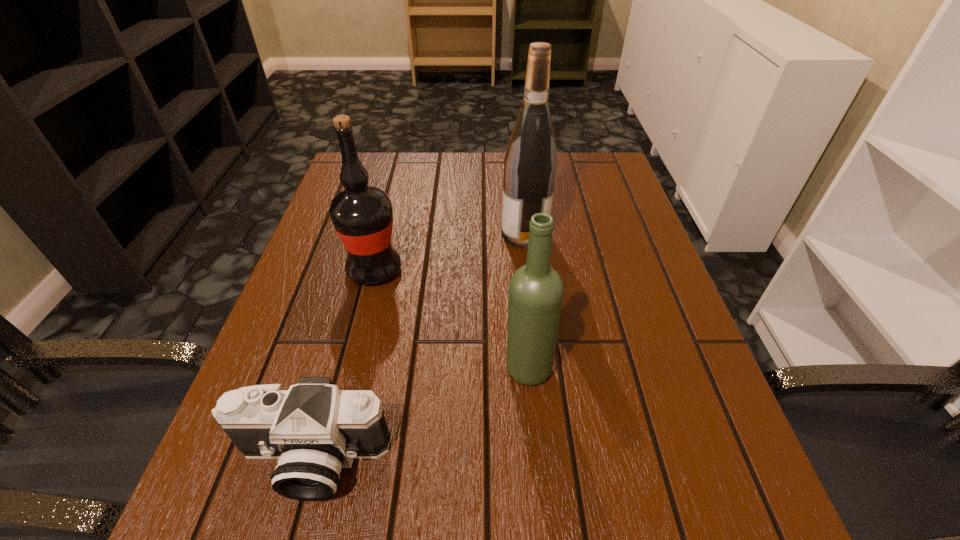
Locate an element on the screen. The height and width of the screenshot is (540, 960). free space between the shortest object and the second farthest wine bottle is located at coordinates (343, 364).

Identify which object is the second closest to the farthest wine bottle. Please provide its 2D coordinates. Your answer should be formatted as a tuple, i.e. [(x, y)], where the tuple contains the x and y coordinates of a point satisfying the conditions above.

[(536, 290)]

Point out which object is positioned as the second nearest to the second nearest wine bottle. Please provide its 2D coordinates. Your answer should be formatted as a tuple, i.e. [(x, y)], where the tuple contains the x and y coordinates of a point satisfying the conditions above.

[(536, 290)]

Select which wine bottle appears as the second closest to the leftmost wine bottle. Please provide its 2D coordinates. Your answer should be formatted as a tuple, i.e. [(x, y)], where the tuple contains the x and y coordinates of a point satisfying the conditions above.

[(536, 290)]

Choose which wine bottle is the nearest neighbor to the leftmost wine bottle. Please provide its 2D coordinates. Your answer should be formatted as a tuple, i.e. [(x, y)], where the tuple contains the x and y coordinates of a point satisfying the conditions above.

[(530, 163)]

Find the location of a particular element. The width and height of the screenshot is (960, 540). vacant space that satisfies the following two spatial constraints: 1. on the back side of the shortest object; 2. on the left side of the nearest wine bottle is located at coordinates (336, 368).

Identify the location of free space that satisfies the following two spatial constraints: 1. on the back side of the shortest object; 2. on the left side of the farthest wine bottle. Image resolution: width=960 pixels, height=540 pixels. (373, 233).

The image size is (960, 540). Identify the location of free location that satisfies the following two spatial constraints: 1. on the back side of the nearest object; 2. on the right side of the second nearest wine bottle. (363, 270).

You are a GUI agent. You are given a task and a screenshot of the screen. Output one action in this format:
    pyautogui.click(x=<x>, y=<y>)
    Task: Click on the free space that satisfies the following two spatial constraints: 1. on the front side of the third farthest object; 2. on the right side of the leftmost wine bottle
    This screenshot has height=540, width=960.
    Given the screenshot: What is the action you would take?
    pyautogui.click(x=349, y=368)

This screenshot has width=960, height=540. What are the coordinates of `vacant space that satisfies the following two spatial constraints: 1. on the front side of the second nearest wine bottle; 2. on the right side of the third farthest object` in the screenshot? It's located at (349, 368).